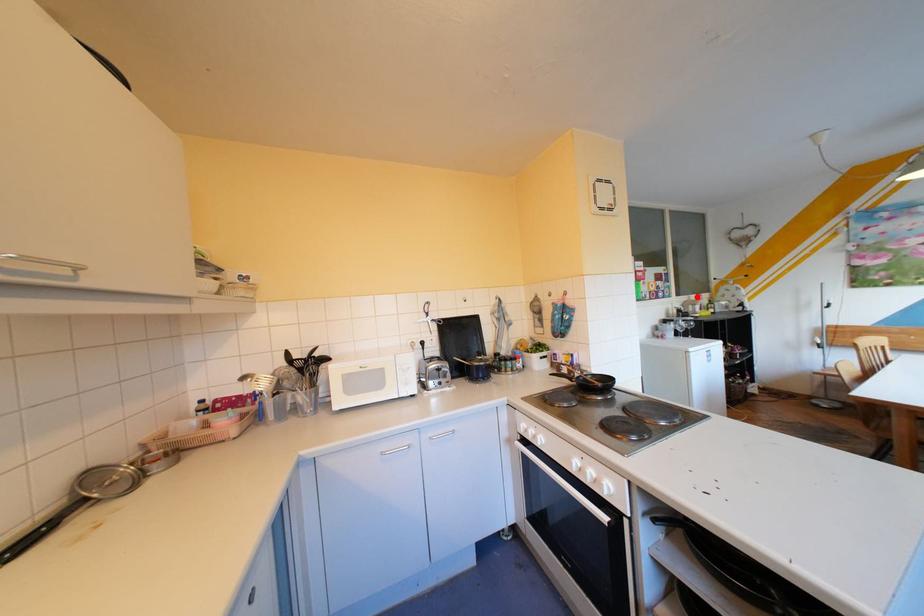
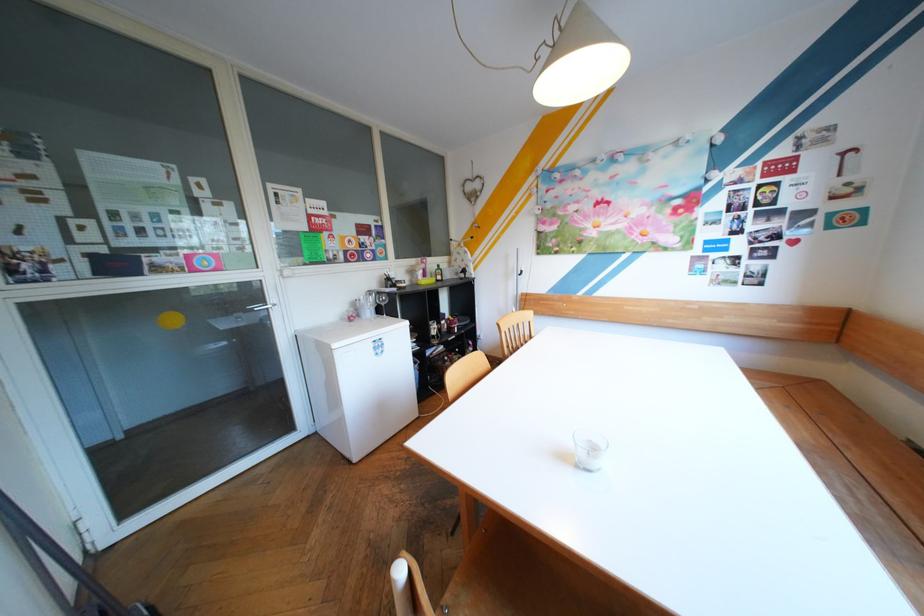
Question: I am providing you with two images of the same scene from different viewpoints. Image1 has a red point marked. In image2, the corresponding 3D location appears at what relative position? Reply with the corresponding letter.

Choices:
 (A) Closer
 (B) Farther

Answer: (A)